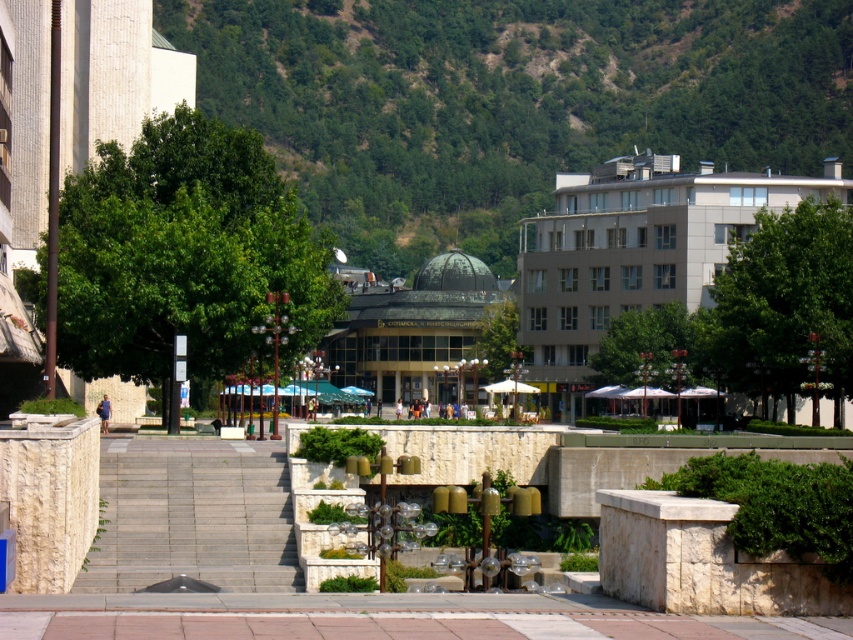
Can you confirm if green leafy hillside at upper center is positioned to the left of beige concrete building at right?

Incorrect, green leafy hillside at upper center is not on the left side of beige concrete building at right.

Does green leafy hillside at upper center appear under beige concrete building at right?

No, green leafy hillside at upper center is not below beige concrete building at right.

Find the location of a particular element. The height and width of the screenshot is (640, 853). green leafy hillside at upper center is located at coordinates (509, 100).

Where is `green leafy hillside at upper center`? The height and width of the screenshot is (640, 853). green leafy hillside at upper center is located at coordinates (509, 100).

Is green leafy hillside at upper center shorter than green glass dome at center?

No, green leafy hillside at upper center is not shorter than green glass dome at center.

Does point (405, 49) come in front of point (428, 308)?

No, it is behind (428, 308).

I want to click on green leafy hillside at upper center, so click(x=509, y=100).

Can you confirm if green leafy hillside at upper center is shorter than gray stone stairs at center?

Incorrect, green leafy hillside at upper center's height does not fall short of gray stone stairs at center's.

In order to click on green leafy hillside at upper center in this screenshot , I will do `click(509, 100)`.

Find the location of `green leafy hillside at upper center`. green leafy hillside at upper center is located at coordinates (509, 100).

You are a GUI agent. You are given a task and a screenshot of the screen. Output one action in this format:
    pyautogui.click(x=<x>, y=<y>)
    Task: Click on the green leafy hillside at upper center
    The width and height of the screenshot is (853, 640).
    Given the screenshot: What is the action you would take?
    pyautogui.click(x=509, y=100)